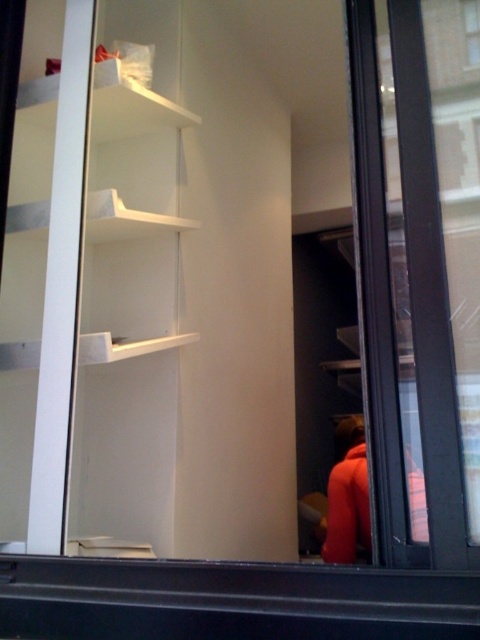
Can you confirm if transparent glass door at right is thinner than orange fabric jacket at right?

Yes.

Is transparent glass door at right to the left of orange fabric jacket at right from the viewer's perspective?

Correct, you'll find transparent glass door at right to the left of orange fabric jacket at right.

In order to click on transparent glass door at right in this screenshot , I will do `click(419, 273)`.

Locate an element on the screen. transparent glass door at right is located at coordinates (419, 273).

Is orange fabric jacket at right to the right of clear glass window at upper right from the viewer's perspective?

Incorrect, orange fabric jacket at right is not on the right side of clear glass window at upper right.

Which is more to the left, orange fabric jacket at right or clear glass window at upper right?

Positioned to the left is orange fabric jacket at right.

Between point (427, 538) and point (477, 58), which one is positioned in front?

Positioned in front is point (427, 538).

Locate an element on the screen. orange fabric jacket at right is located at coordinates (348, 496).

Is point (410, 124) closer to camera compared to point (468, 61)?

Yes, it is in front of point (468, 61).

Does point (388, 388) come in front of point (479, 45)?

Yes, it is in front of point (479, 45).

At what (x,y) coordinates should I click in order to perform the action: click on transparent glass door at right. Please return your answer as a coordinate pair (x, y). Looking at the image, I should click on point(419,273).